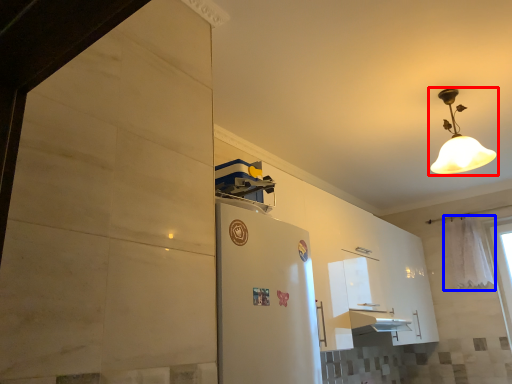
Question: Which object appears closest to the camera in this image, lamp (highlighted by a red box) or curtain (highlighted by a blue box)?

Choices:
 (A) lamp
 (B) curtain

Answer: (A)